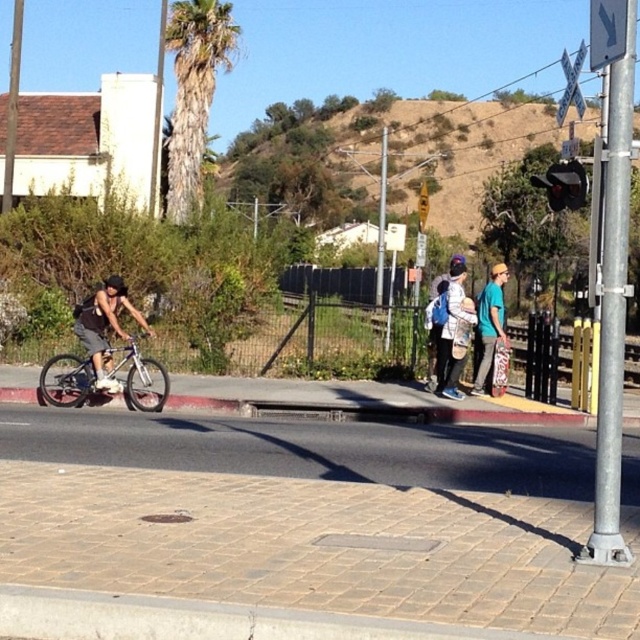
You are a pedestrian standing on the sidewalk and want to pick up both the matte blue backpack at center and the teal fabric hoodie at center. Which one should you reach for first if you want to grab the item that is closer to your left side?

The matte blue backpack at center is to the left of the teal fabric hoodie at center, so you should reach for the matte blue backpack at center first as it is closer to your left side.

You are a delivery driver approaching the railroad crossing and see the brushed metal arrow at upper right and the brushed metal railroad crossing sign at upper right. Which one is higher up in the image?

The brushed metal arrow at upper right is above the brushed metal railroad crossing sign at upper right.